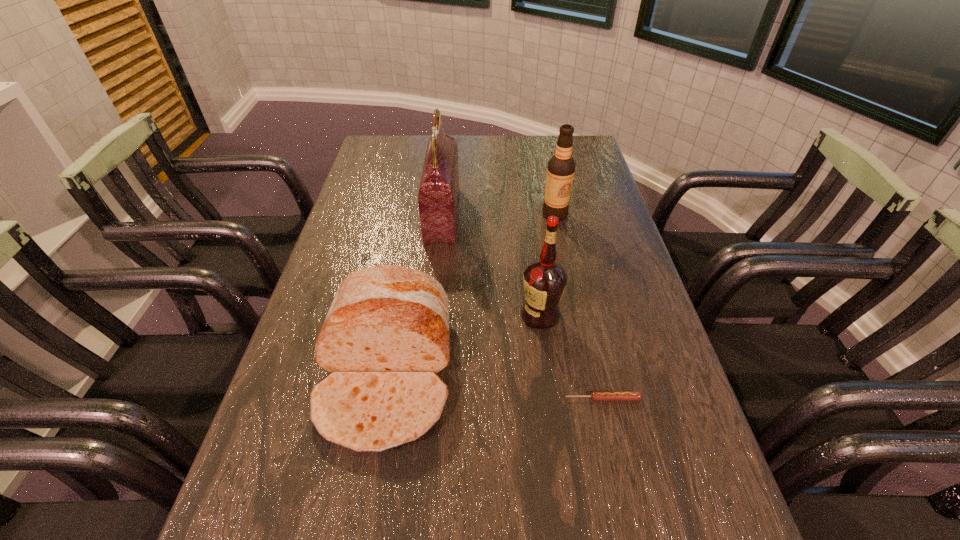
Where is `handbag`? This screenshot has height=540, width=960. handbag is located at coordinates (438, 196).

Locate an element on the screen. the nearer alcohol is located at coordinates coord(545,280).

Find the location of a particular element. the farther alcohol is located at coordinates (561, 167).

Locate an element on the screen. The image size is (960, 540). bread is located at coordinates (386, 336).

At what (x,y) coordinates should I click in order to perform the action: click on sausage. Please return your answer as a coordinate pair (x, y). Looking at the image, I should click on (596, 395).

In order to click on vacant space located 0.270m on the front-facing side of the handbag in this screenshot , I will do `click(547, 215)`.

Identify the location of free point located on the label of the nearer alcohol. (390, 315).

Where is `free region located 0.260m on the label of the nearer alcohol`? The width and height of the screenshot is (960, 540). free region located 0.260m on the label of the nearer alcohol is located at coordinates [411, 315].

This screenshot has height=540, width=960. In order to click on free space located 0.330m on the label of the nearer alcohol in this screenshot , I will do coord(382,315).

This screenshot has width=960, height=540. I want to click on free space located on the label of the farther alcohol, so click(x=577, y=323).